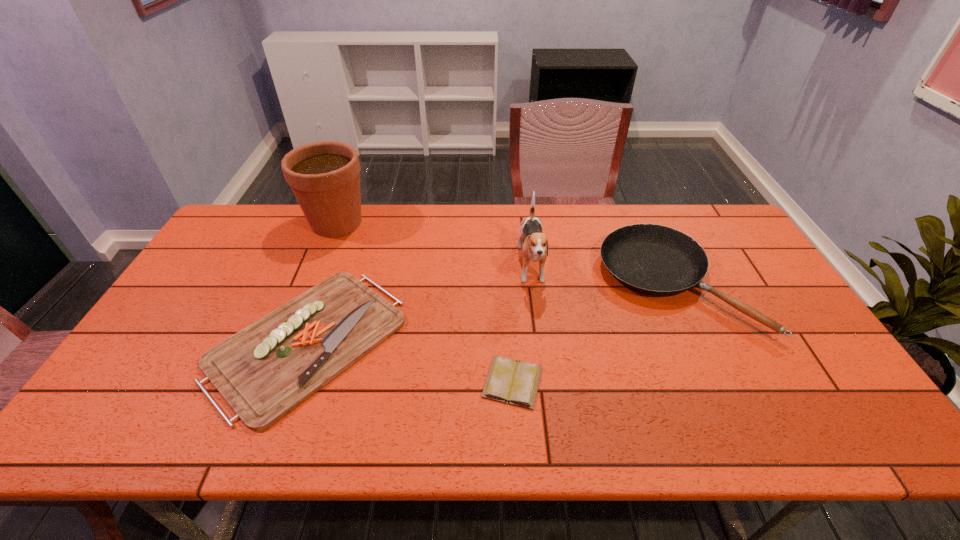
Locate an element on the screen. The height and width of the screenshot is (540, 960). vacant space that's between the rightmost object and the chopping board is located at coordinates (492, 312).

At what (x,y) coordinates should I click in order to perform the action: click on free space between the flowerpot and the fourth shortest object. Please return your answer as a coordinate pair (x, y). The width and height of the screenshot is (960, 540). Looking at the image, I should click on (434, 246).

At what (x,y) coordinates should I click in order to perform the action: click on vacant area between the second shortest object and the rightmost object. Please return your answer as a coordinate pair (x, y). Looking at the image, I should click on (492, 312).

Image resolution: width=960 pixels, height=540 pixels. What are the coordinates of `object that is the third nearest to the flowerpot` in the screenshot? It's located at (513, 382).

Identify the location of the second closest object relative to the flowerpot. (535, 248).

Find the location of a particular element. This screenshot has height=540, width=960. vacant area in the image that satisfies the following two spatial constraints: 1. at the face of the puppy; 2. on the left side of the rightmost object is located at coordinates (534, 284).

You are a GUI agent. You are given a task and a screenshot of the screen. Output one action in this format:
    pyautogui.click(x=<x>, y=<y>)
    Task: Click on the free space that satisfies the following two spatial constraints: 1. on the back side of the shortest object; 2. on the left side of the frying pan
    The width and height of the screenshot is (960, 540).
    Given the screenshot: What is the action you would take?
    pyautogui.click(x=507, y=284)